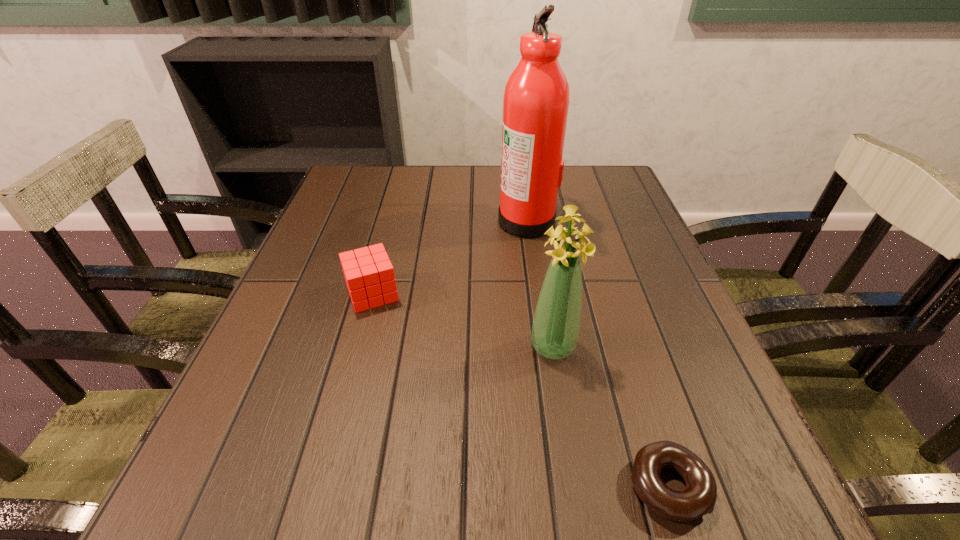
The height and width of the screenshot is (540, 960). In order to click on blank space at the near edge in this screenshot , I will do `click(578, 511)`.

In the image, there is a desktop. Identify the location of blank space at the left edge. (322, 278).

The height and width of the screenshot is (540, 960). I want to click on vacant region at the right edge of the desktop, so click(x=611, y=280).

At what (x,y) coordinates should I click in order to perform the action: click on vacant space at the far left corner. Please return your answer as a coordinate pair (x, y). Looking at the image, I should click on (333, 197).

At what (x,y) coordinates should I click in order to perform the action: click on vacant space at the far right corner. Please return your answer as a coordinate pair (x, y). The width and height of the screenshot is (960, 540). Looking at the image, I should click on (622, 181).

Image resolution: width=960 pixels, height=540 pixels. In order to click on free space that is in between the rightmost object and the cube in this screenshot , I will do `click(519, 390)`.

Find the location of `unoccupied position between the bouquet and the third tallest object`. unoccupied position between the bouquet and the third tallest object is located at coordinates (463, 320).

What are the coordinates of `free spot between the bouquet and the rightmost object` in the screenshot? It's located at (610, 416).

At what (x,y) coordinates should I click in order to perform the action: click on unoccupied position between the cube and the second nearest object. Please return your answer as a coordinate pair (x, y). Looking at the image, I should click on (463, 320).

Locate an element on the screen. free space between the bouquet and the shortest object is located at coordinates (610, 416).